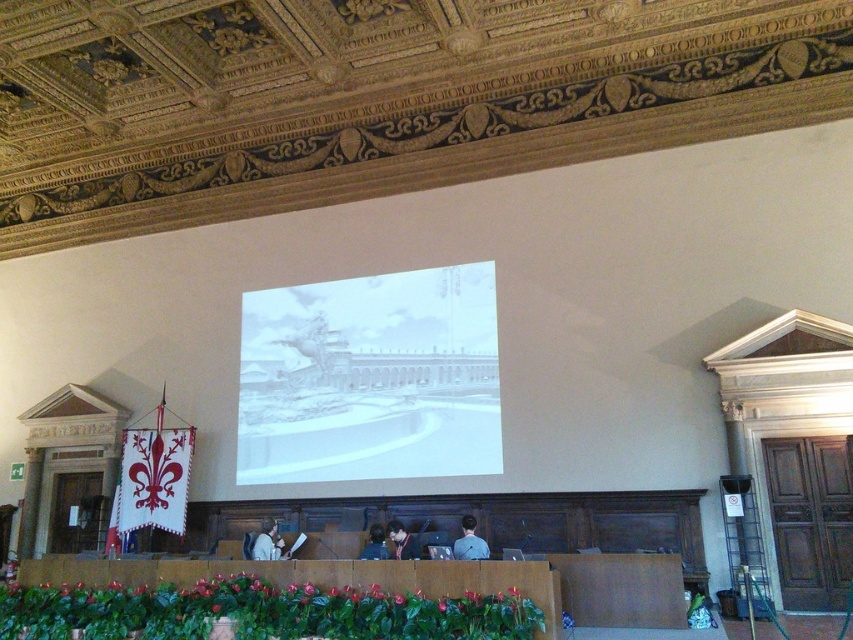
Is the position of white paper at center more distant than that of dark blue fabric at center?

Yes, white paper at center is further from the viewer.

Which is more to the right, white paper at center or dark blue fabric at center?

dark blue fabric at center

Between point (273, 316) and point (384, 554), which one is positioned behind?

The point (273, 316) is more distant.

At what (x,y) coordinates should I click in order to perform the action: click on white paper at center. Please return your answer as a coordinate pair (x, y). The height and width of the screenshot is (640, 853). Looking at the image, I should click on (370, 378).

Is point (395, 536) closer to camera compared to point (381, 531)?

Yes.

This screenshot has height=640, width=853. I want to click on matte black laptop at center, so click(404, 541).

Can you confirm if gray fabric shirt at center is positioned below dark blue fabric at center?

Actually, gray fabric shirt at center is above dark blue fabric at center.

Is point (485, 541) closer to camera compared to point (366, 544)?

Yes.

The image size is (853, 640). Find the location of `gray fabric shirt at center`. gray fabric shirt at center is located at coordinates (469, 541).